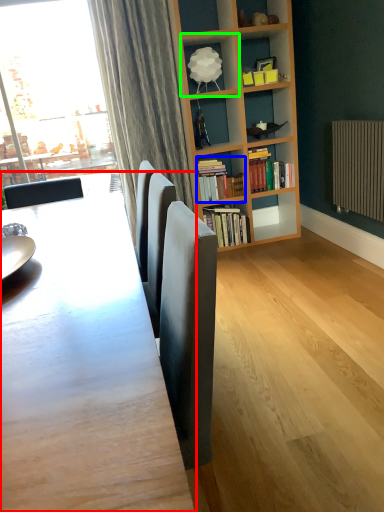
Question: Considering the real-world distances, which object is closest to table (highlighted by a red box)? book (highlighted by a blue box) or shelf (highlighted by a green box).

Choices:
 (A) book
 (B) shelf

Answer: (A)